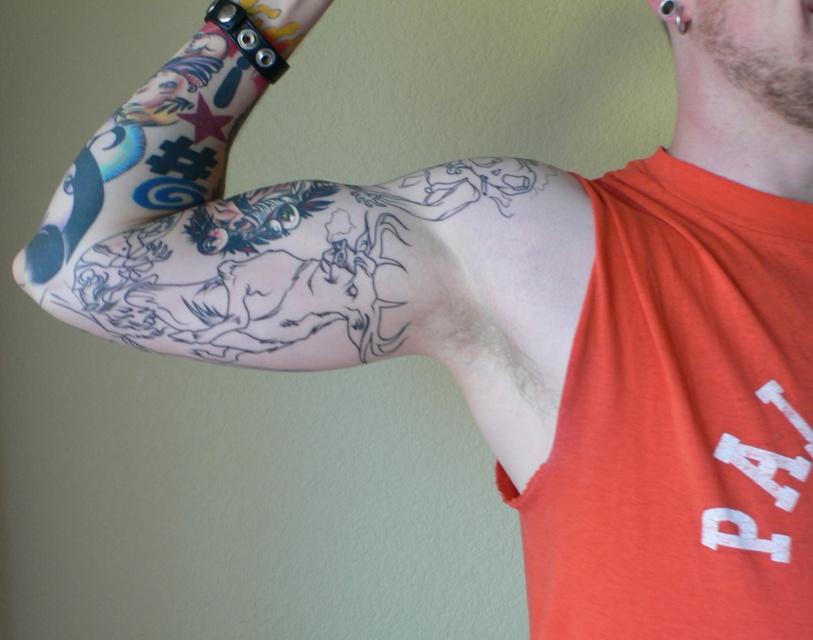
Question: Which point is farther to the camera?

Choices:
 (A) (675, 428)
 (B) (188, 220)

Answer: (B)

Question: Does orange cotton tank top at upper right appear on the right side of black ink tattoo at upper left?

Choices:
 (A) no
 (B) yes

Answer: (B)

Question: Which object is closer to the camera taking this photo?

Choices:
 (A) orange cotton tank top at upper right
 (B) black ink tattoo at upper left

Answer: (A)

Question: Does orange cotton tank top at upper right have a greater width compared to black ink tattoo at upper left?

Choices:
 (A) yes
 (B) no

Answer: (B)

Question: Among these objects, which one is farthest from the camera?

Choices:
 (A) orange cotton tank top at upper right
 (B) black ink tattoo at upper left

Answer: (B)

Question: From the image, what is the correct spatial relationship of orange cotton tank top at upper right in relation to black ink tattoo at upper left?

Choices:
 (A) below
 (B) above

Answer: (A)